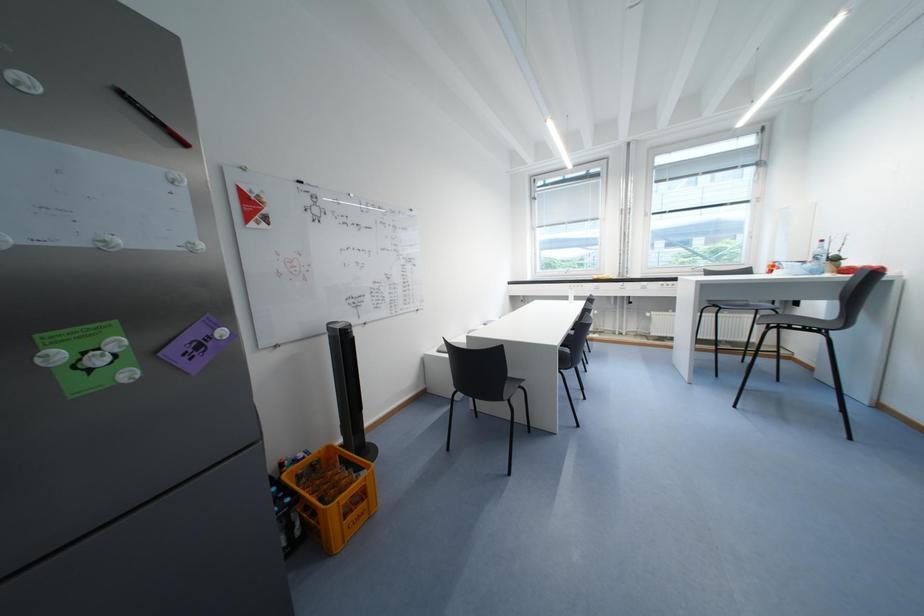
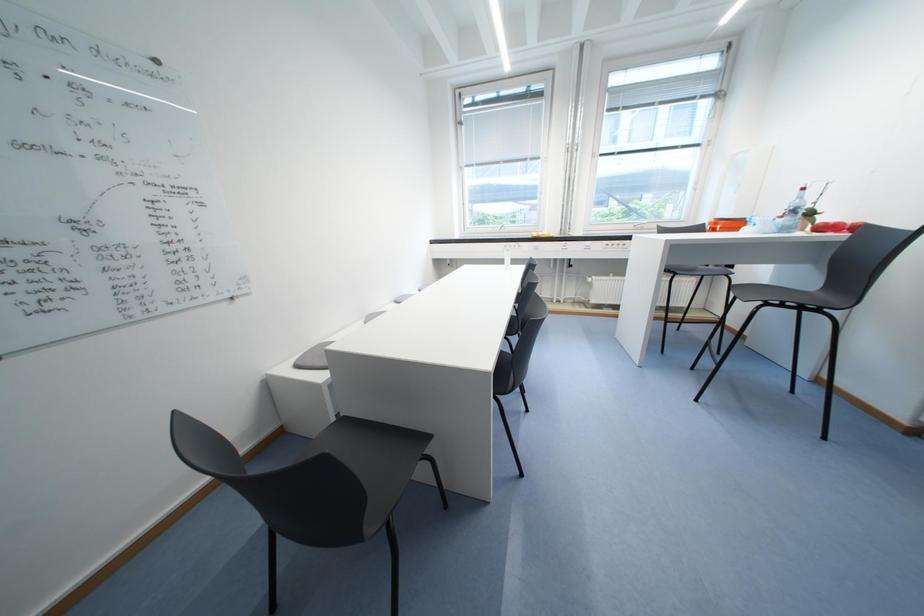
In a continuous first-person perspective shot, in which direction is the camera moving?

The cameraman walked toward right, forward.